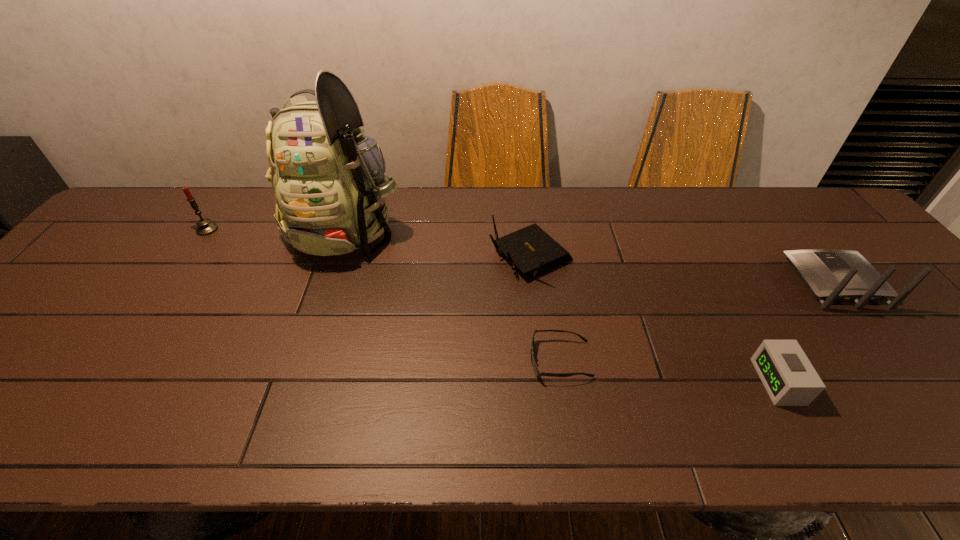
This screenshot has height=540, width=960. I want to click on the tallest object, so click(328, 179).

Where is `backpack`? backpack is located at coordinates pos(328,179).

Where is `the leftmost object`? the leftmost object is located at coordinates (205, 227).

Locate an element on the screen. the right router is located at coordinates (831, 275).

Locate an element on the screen. The image size is (960, 540). the rightmost object is located at coordinates (831, 275).

I want to click on the third shortest object, so click(x=530, y=249).

Locate an element on the screen. The width and height of the screenshot is (960, 540). the shorter router is located at coordinates (530, 249).

At what (x,y) coordinates should I click in order to perform the action: click on alarm clock. Please return your answer as a coordinate pair (x, y). Looking at the image, I should click on (788, 376).

Find the location of a particular element. The width and height of the screenshot is (960, 540). the fifth object from left to right is located at coordinates (788, 376).

Where is `the shortest object`? Image resolution: width=960 pixels, height=540 pixels. the shortest object is located at coordinates (537, 372).